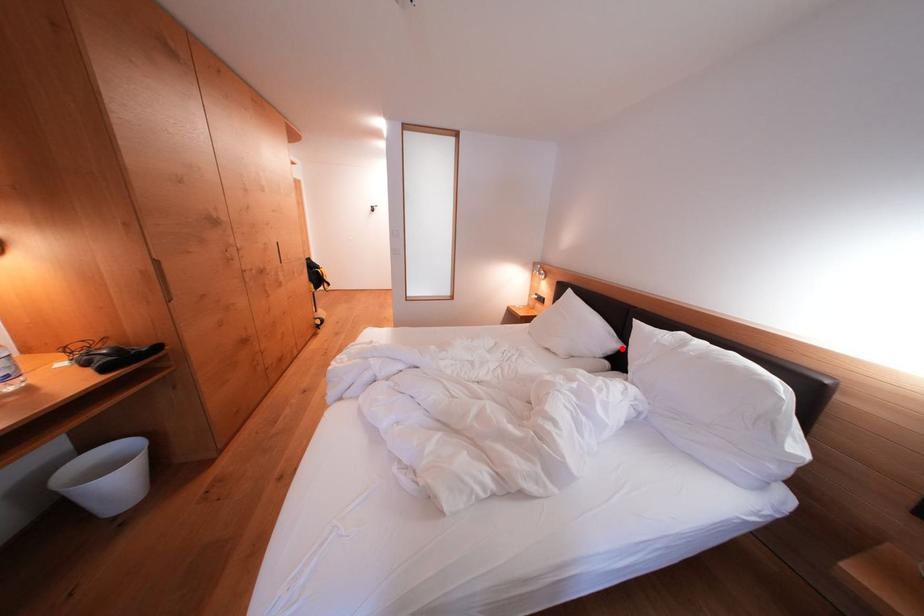
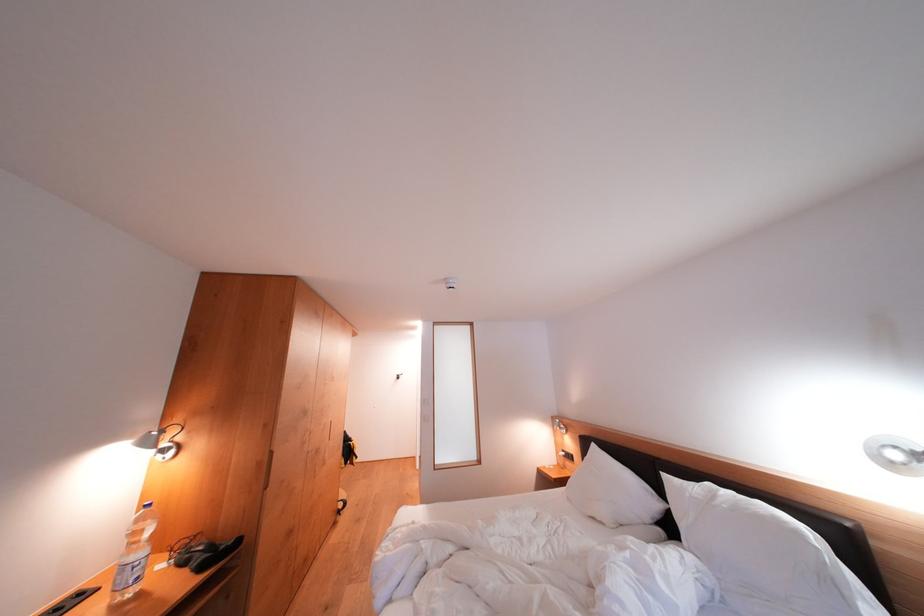
Question: I am providing you with two images of the same scene from different viewpoints. A red point is shown in image1. For the corresponding object point in image2, is it positioned nearer or farther from the camera?

Choices:
 (A) Nearer
 (B) Farther

Answer: (A)